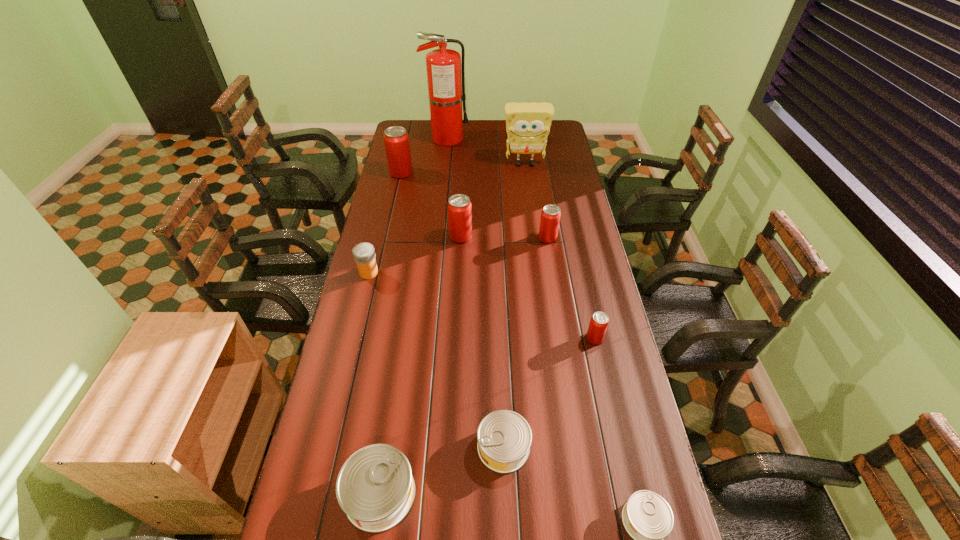
Identify which red can is the fourth nearest to the second smallest silver can. Please provide its 2D coordinates. Your answer should be formatted as a tuple, i.e. [(x, y)], where the tuple contains the x and y coordinates of a point satisfying the conditions above.

[(396, 139)]

Identify which silver can is the nearest to the red fire extinguisher. Please provide its 2D coordinates. Your answer should be formatted as a tuple, i.e. [(x, y)], where the tuple contains the x and y coordinates of a point satisfying the conditions above.

[(504, 437)]

Locate which silver can ranks in proximity to the orange medicine. Please provide its 2D coordinates. Your answer should be formatted as a tuple, i.e. [(x, y)], where the tuple contains the x and y coordinates of a point satisfying the conditions above.

[(375, 487)]

Where is `free point that satisfies the following two spatial constraints: 1. at the nozzle of the fourth can from left to right; 2. on the right side of the tallest object`? free point that satisfies the following two spatial constraints: 1. at the nozzle of the fourth can from left to right; 2. on the right side of the tallest object is located at coordinates (x=415, y=447).

Where is `vacant region that satisfies the following two spatial constraints: 1. on the label side of the medicine; 2. on the left side of the leftmost silver can`? Image resolution: width=960 pixels, height=540 pixels. vacant region that satisfies the following two spatial constraints: 1. on the label side of the medicine; 2. on the left side of the leftmost silver can is located at coordinates (315, 494).

What are the coordinates of `free spot that satisfies the following two spatial constraints: 1. on the back side of the seventh farthest object; 2. at the nozzle of the tallest object` in the screenshot? It's located at (550, 139).